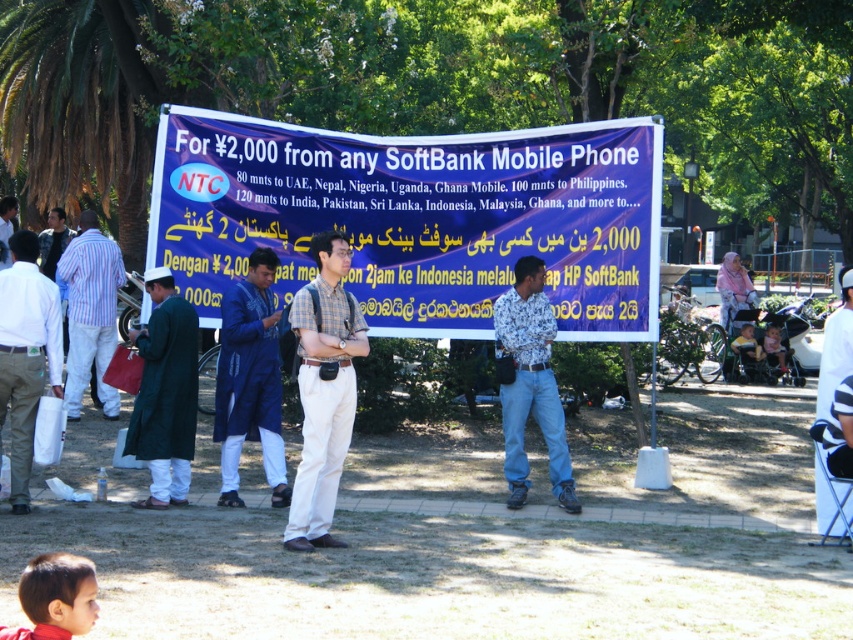
Between plaid fabric shirt at center and striped cotton shirt at left, which one is positioned higher?

striped cotton shirt at left is above.

Does plaid fabric shirt at center have a smaller size compared to striped cotton shirt at left?

Yes, plaid fabric shirt at center is smaller than striped cotton shirt at left.

Does point (332, 497) come in front of point (83, 246)?

Yes, it is in front of point (83, 246).

The image size is (853, 640). Identify the location of plaid fabric shirt at center. (323, 388).

Is dark green coat at left taller than light pink fabric baby carriage at center?

Incorrect, dark green coat at left's height is not larger of light pink fabric baby carriage at center's.

Does point (6, 262) come in front of point (769, 344)?

Yes, it is.

Does point (7, 256) lie in front of point (773, 364)?

Yes.

Where is `dark green coat at left`? Image resolution: width=853 pixels, height=640 pixels. dark green coat at left is located at coordinates (6, 227).

Is blue cotton kurta at center above light pink fabric baby carriage at center?

Incorrect, blue cotton kurta at center is not positioned above light pink fabric baby carriage at center.

The width and height of the screenshot is (853, 640). Describe the element at coordinates (250, 380) in the screenshot. I see `blue cotton kurta at center` at that location.

Which is in front, point (258, 397) or point (772, 339)?

Point (258, 397) is in front.

Where is `blue cotton kurta at center`? The width and height of the screenshot is (853, 640). blue cotton kurta at center is located at coordinates (250, 380).